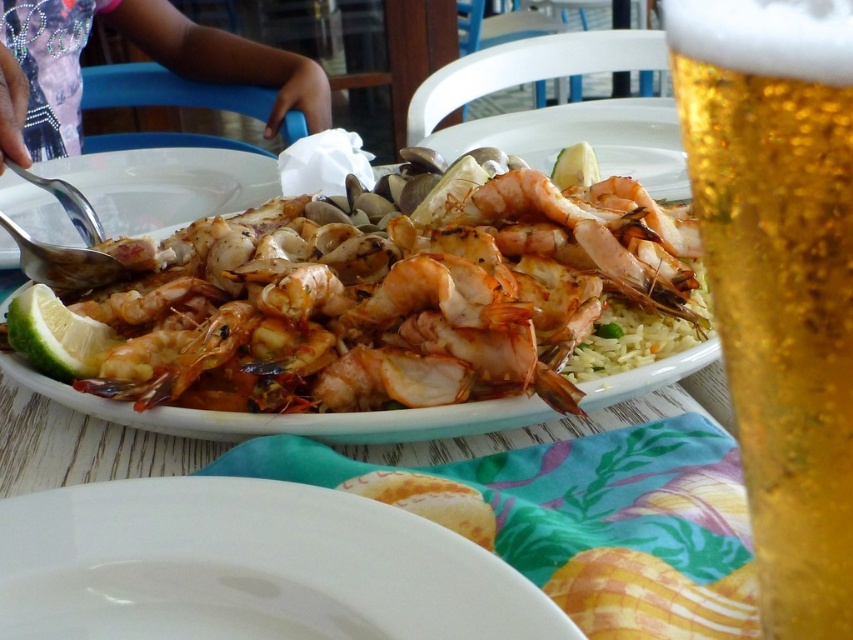
Question: Does shiny ceramic plate at center appear over green matte lemon at lower left?

Choices:
 (A) no
 (B) yes

Answer: (B)

Question: Is matte white plate at upper left wider than green matte lemon at lower left?

Choices:
 (A) no
 (B) yes

Answer: (B)

Question: Which point is closer to the camera?

Choices:
 (A) (792, 428)
 (B) (33, 349)
 (C) (231, 202)

Answer: (A)

Question: Which of the following is the farthest from the observer?

Choices:
 (A) matte white plate at upper left
 (B) green matte lemon at lower left

Answer: (A)

Question: Which point is farther from the camera taking this photo?

Choices:
 (A) (134, 234)
 (B) (596, 337)
 (C) (770, 129)
 (D) (22, 346)

Answer: (A)

Question: Does matte white plate at upper left appear on the right side of green matte lemon at lower left?

Choices:
 (A) no
 (B) yes

Answer: (A)